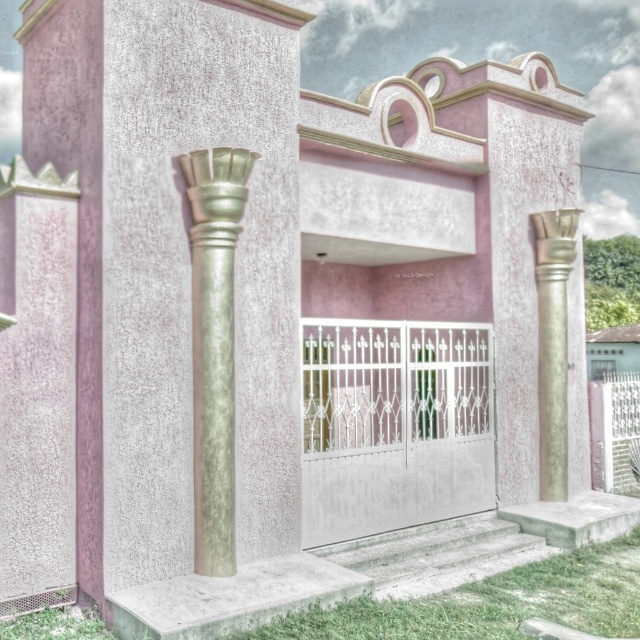
Is green marble column at left to the left of gold textured column at right from the viewer's perspective?

Indeed, green marble column at left is positioned on the left side of gold textured column at right.

From the picture: Does green marble column at left have a smaller size compared to gold textured column at right?

Indeed, green marble column at left has a smaller size compared to gold textured column at right.

Where is `green marble column at left`? The height and width of the screenshot is (640, 640). green marble column at left is located at coordinates (212, 346).

You are a GUI agent. You are given a task and a screenshot of the screen. Output one action in this format:
    pyautogui.click(x=<x>, y=<y>)
    Task: Click on the green marble column at left
    Image resolution: width=640 pixels, height=640 pixels.
    Given the screenshot: What is the action you would take?
    pyautogui.click(x=212, y=346)